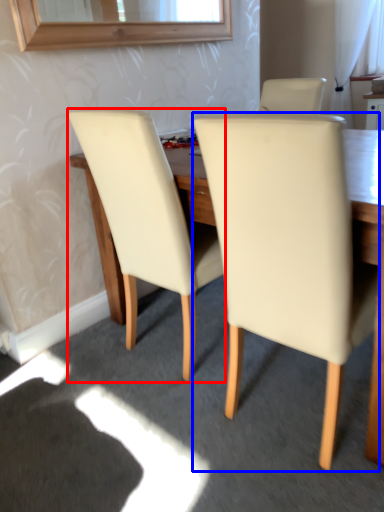
Question: Which of the following is the closest to the observer, chair (highlighted by a red box) or chair (highlighted by a blue box)?

Choices:
 (A) chair
 (B) chair

Answer: (B)